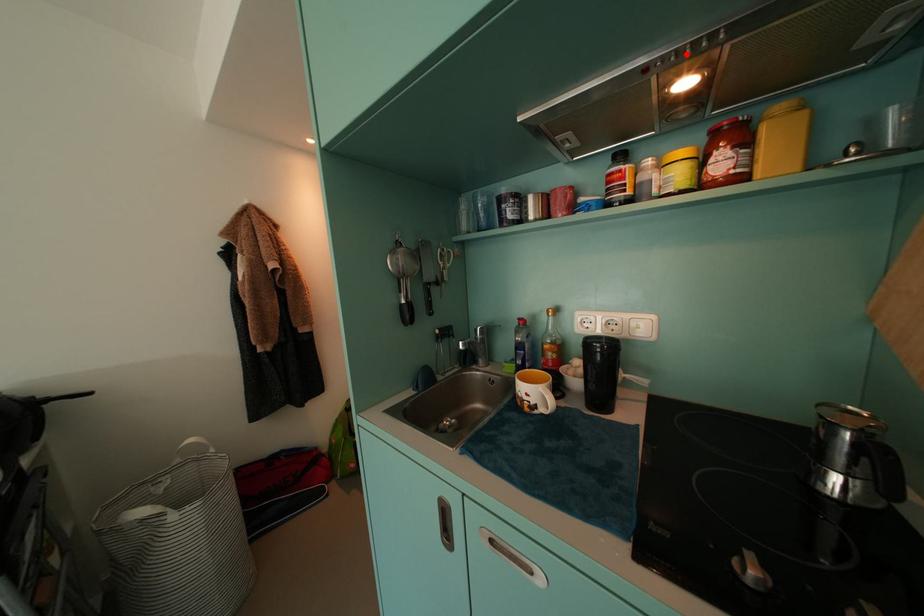
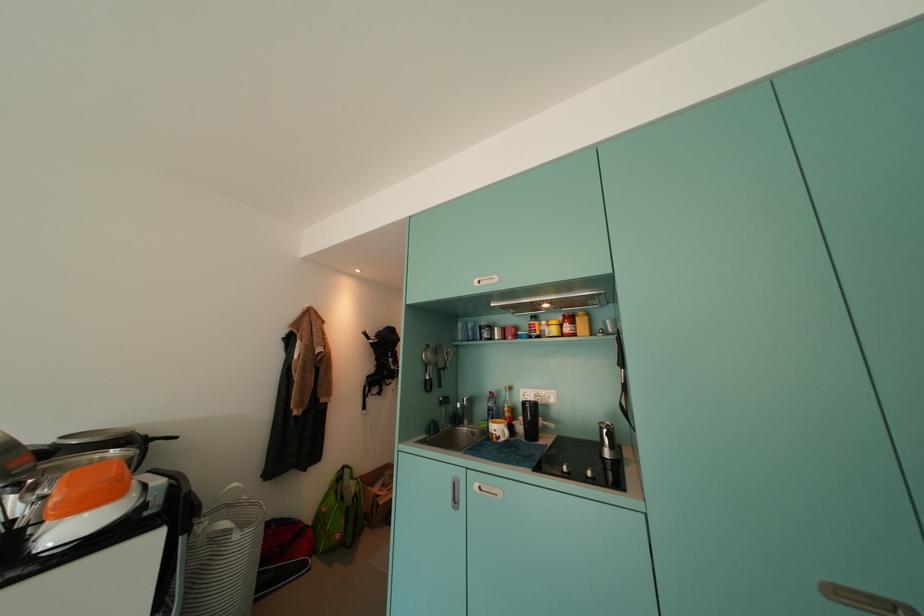
Question: I am providing you with two images of the same scene from different viewpoints. A red point is marked on the first image. Can you still see the location of the red point in image 2?

Choices:
 (A) Yes
 (B) No

Answer: (B)